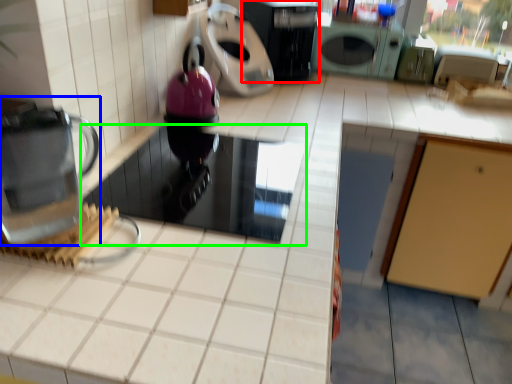
Question: Estimate the real-world distances between objects in this image. Which object is farther from kitchen appliance (highlighted by a red box), home appliance (highlighted by a blue box) or appliance (highlighted by a green box)?

Choices:
 (A) home appliance
 (B) appliance

Answer: (A)